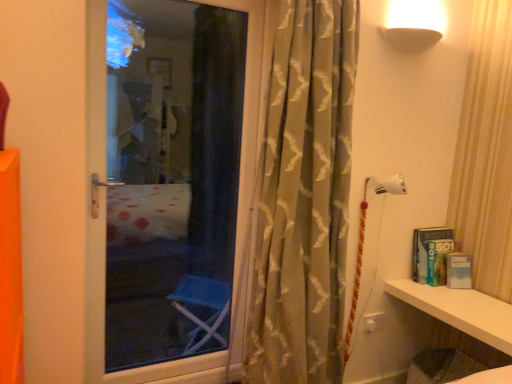
What is the approximate height of silky beige curtain at center?

1.89 meters.

What do you see at coordinates (304, 198) in the screenshot? This screenshot has height=384, width=512. I see `silky beige curtain at center` at bounding box center [304, 198].

The image size is (512, 384). Identify the location of silky beige curtain at center. (304, 198).

Describe the element at coordinates (460, 310) in the screenshot. I see `white glossy shelf at lower right` at that location.

Measure the distance between white glossy shelf at lower right and camera.

The distance of white glossy shelf at lower right from camera is 5.31 feet.

Where is `white glossy shelf at lower right`? white glossy shelf at lower right is located at coordinates (460, 310).

This screenshot has height=384, width=512. Find the location of `silky beige curtain at center`. silky beige curtain at center is located at coordinates (304, 198).

Does silky beige curtain at center appear on the left side of white glossy shelf at lower right?

Yes.

Is the depth of silky beige curtain at center greater than that of white glossy shelf at lower right?

No, silky beige curtain at center is closer to the viewer.

Which is closer to the camera, (277, 141) or (497, 343)?

Point (277, 141) appears to be farther away from the viewer than point (497, 343).

From the image's perspective, is silky beige curtain at center located above or below white glossy shelf at lower right?

silky beige curtain at center is above white glossy shelf at lower right.

From a real-world perspective, does silky beige curtain at center sit lower than white glossy shelf at lower right?

No, from a real-world perspective, silky beige curtain at center is not under white glossy shelf at lower right.

Is silky beige curtain at center wider or thinner than white glossy shelf at lower right?

Considering their sizes, silky beige curtain at center looks slimmer than white glossy shelf at lower right.

Considering the relative sizes of silky beige curtain at center and white glossy shelf at lower right in the image provided, is silky beige curtain at center shorter than white glossy shelf at lower right?

Incorrect, the height of silky beige curtain at center does not fall short of that of white glossy shelf at lower right.

Does silky beige curtain at center have a larger size compared to white glossy shelf at lower right?

Yes, silky beige curtain at center is bigger than white glossy shelf at lower right.

Based on the photo, is silky beige curtain at center not within white glossy shelf at lower right?

silky beige curtain at center is positioned outside white glossy shelf at lower right.

Are silky beige curtain at center and white glossy shelf at lower right far apart?

No, there isn't a large distance between silky beige curtain at center and white glossy shelf at lower right.

Is silky beige curtain at center oriented away from white glossy shelf at lower right?

silky beige curtain at center does not have its back to white glossy shelf at lower right.

Where is `curtain in front of the white glossy shelf at lower right`? The width and height of the screenshot is (512, 384). curtain in front of the white glossy shelf at lower right is located at coordinates (304, 198).

Visually, is white glossy shelf at lower right positioned to the left or to the right of silky beige curtain at center?

From the image, it's evident that white glossy shelf at lower right is to the right of silky beige curtain at center.

Which object is closer to the camera, white glossy shelf at lower right or silky beige curtain at center?

silky beige curtain at center is more forward.

Is point (401, 287) behind point (278, 89)?

That is True.

From the image's perspective, does white glossy shelf at lower right appear lower than silky beige curtain at center?

Yes, from the image's perspective, white glossy shelf at lower right is below silky beige curtain at center.

From a real-world perspective, is white glossy shelf at lower right under silky beige curtain at center?

Correct, in the physical world, white glossy shelf at lower right is lower than silky beige curtain at center.

Between white glossy shelf at lower right and silky beige curtain at center, which one has smaller width?

silky beige curtain at center.

Is white glossy shelf at lower right taller or shorter than silky beige curtain at center?

Clearly, white glossy shelf at lower right is shorter compared to silky beige curtain at center.

Between white glossy shelf at lower right and silky beige curtain at center, which one has larger size?

With larger size is silky beige curtain at center.

Do you think white glossy shelf at lower right is within silky beige curtain at center, or outside of it?

white glossy shelf at lower right is spatially situated outside silky beige curtain at center.

Is white glossy shelf at lower right not near silky beige curtain at center?

They are positioned close to each other.

Could you tell me if white glossy shelf at lower right is facing silky beige curtain at center?

No, white glossy shelf at lower right is not oriented towards silky beige curtain at center.

How distant is white glossy shelf at lower right from silky beige curtain at center?

The distance of white glossy shelf at lower right from silky beige curtain at center is 29.55 inches.

In order to click on shelf that is under the silky beige curtain at center (from a real-world perspective) in this screenshot , I will do `click(460, 310)`.

This screenshot has width=512, height=384. What are the coordinates of `curtain on the left of white glossy shelf at lower right` in the screenshot? It's located at (304, 198).

In the image, there is a silky beige curtain at center. Where is `shelf below it (from the image's perspective)`? The image size is (512, 384). shelf below it (from the image's perspective) is located at coordinates (460, 310).